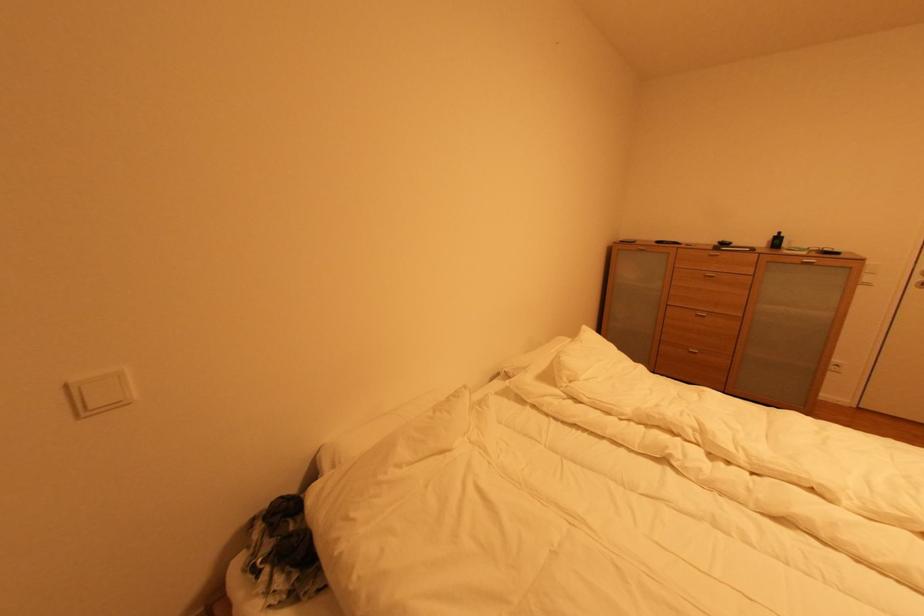
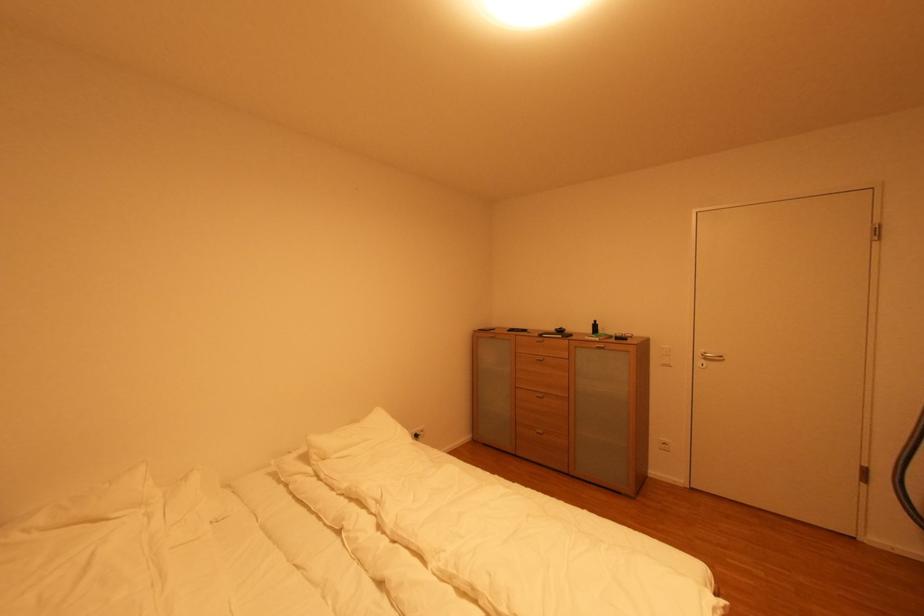
Locate, in the second image, the point that corresponds to point (577, 383) in the first image.

(330, 461)